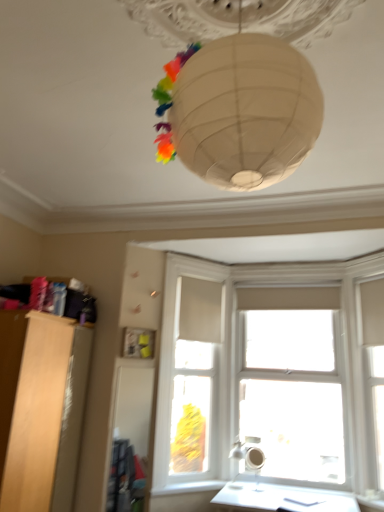
What do you see at coordinates (249, 455) in the screenshot? The image size is (384, 512). I see `matte white lampshade at lower center` at bounding box center [249, 455].

The image size is (384, 512). Identify the location of matte white lampshade at lower center. (249, 455).

Is the depth of light wood cabinet at left greater than that of white matte window frame at right, which is the 1th window frame in right-to-left order?

No, light wood cabinet at left is in front of white matte window frame at right, which is the 1th window frame in right-to-left order.

Is point (34, 378) positioned after point (379, 374)?

No, (34, 378) is closer to viewer.

How distant is light wood cabinet at left from white matte window frame at right, the 2th window frame from the left?

light wood cabinet at left and white matte window frame at right, the 2th window frame from the left, are 8.35 feet apart from each other.

Who is taller, white smooth window sill at lower center or white wood window frame at center, marked as the first window frame in a left-to-right arrangement?

→ With more height is white wood window frame at center, marked as the first window frame in a left-to-right arrangement.

Consider the image. Are white smooth window sill at lower center and white wood window frame at center, arranged as the second window frame when viewed from the right, making contact?

No, white smooth window sill at lower center is not beside white wood window frame at center, arranged as the second window frame when viewed from the right.

Between white smooth window sill at lower center and white wood window frame at center, marked as the first window frame in a left-to-right arrangement, which one has smaller width?

white smooth window sill at lower center.

Is white smooth window sill at lower center positioned with its back to white wood window frame at center, marked as the first window frame in a left-to-right arrangement?

No.

Consider the image. What's the angular difference between matte white lampshade at lower center and white wood window frame at center, arranged as the second window frame when viewed from the right,'s facing directions?

The angular difference between matte white lampshade at lower center and white wood window frame at center, arranged as the second window frame when viewed from the right, is 45.1 degrees.

Is matte white lampshade at lower center far away from white wood window frame at center, arranged as the second window frame when viewed from the right?

Actually, matte white lampshade at lower center and white wood window frame at center, arranged as the second window frame when viewed from the right, are a little close together.

Considering the relative sizes of matte white lampshade at lower center and white wood window frame at center, arranged as the second window frame when viewed from the right, in the image provided, is matte white lampshade at lower center smaller than white wood window frame at center, arranged as the second window frame when viewed from the right,?

Yes, matte white lampshade at lower center is smaller than white wood window frame at center, arranged as the second window frame when viewed from the right.

Can you confirm if white wood window frame at center, arranged as the second window frame when viewed from the right, is taller than transparent glass window at center?

In fact, white wood window frame at center, arranged as the second window frame when viewed from the right, may be shorter than transparent glass window at center.

Based on their positions, is white wood window frame at center, arranged as the second window frame when viewed from the right, located to the left or right of transparent glass window at center?

From the image, it's evident that white wood window frame at center, arranged as the second window frame when viewed from the right, is to the left of transparent glass window at center.

Can we say white wood window frame at center, arranged as the second window frame when viewed from the right, lies outside transparent glass window at center?

Yes.

Which object is closer to the camera, white wood window frame at center, arranged as the second window frame when viewed from the right, or transparent glass window at center?

white wood window frame at center, arranged as the second window frame when viewed from the right, is in front.

Which of these two, transparent glass window at center or white smooth window sill at lower center, is wider?

With larger width is transparent glass window at center.

From the image's perspective, is transparent glass window at center located above or below white smooth window sill at lower center?

Based on their image positions, transparent glass window at center is located above white smooth window sill at lower center.

From a real-world perspective, is transparent glass window at center on top of white smooth window sill at lower center?

Yes, from a real-world perspective, transparent glass window at center is on top of white smooth window sill at lower center.

Which is behind, point (293, 476) or point (153, 496)?

The point (293, 476) is more distant.

In terms of width, does transparent glass window at center look wider or thinner when compared to light wood cabinet at left?

transparent glass window at center is thinner than light wood cabinet at left.

Looking at the image, does transparent glass window at center seem bigger or smaller compared to light wood cabinet at left?

transparent glass window at center is smaller than light wood cabinet at left.

Which is in front, point (273, 432) or point (18, 494)?

The point (18, 494) is more forward.

Could light wood cabinet at left be considered to be inside transparent glass window at center?

No, light wood cabinet at left is located outside of transparent glass window at center.

Is white wood window frame at center, marked as the first window frame in a left-to-right arrangement, aimed at white smooth window sill at lower center?

No, white wood window frame at center, marked as the first window frame in a left-to-right arrangement, is not aimed at white smooth window sill at lower center.

From the image's perspective, between white wood window frame at center, arranged as the second window frame when viewed from the right, and white smooth window sill at lower center, which one is located above?

white wood window frame at center, arranged as the second window frame when viewed from the right, appears higher in the image.

Which is correct: white wood window frame at center, arranged as the second window frame when viewed from the right, is inside white smooth window sill at lower center, or outside of it?

white wood window frame at center, arranged as the second window frame when viewed from the right, cannot be found inside white smooth window sill at lower center.

You are a GUI agent. You are given a task and a screenshot of the screen. Output one action in this format:
    pyautogui.click(x=<x>, y=<y>)
    Task: Click on the 1st window frame above the white smooth window sill at lower center (from the image's perspective)
    The height and width of the screenshot is (512, 384).
    Given the screenshot: What is the action you would take?
    pyautogui.click(x=190, y=378)

From the light wood cabinet at left, count 2nd window frame to the right and point to it. Please provide its 2D coordinates.

[(372, 373)]

Where is `window sill located below the white wood window frame at center, marked as the first window frame in a left-to-right arrangement (from the image's perspective)`? The height and width of the screenshot is (512, 384). window sill located below the white wood window frame at center, marked as the first window frame in a left-to-right arrangement (from the image's perspective) is located at coordinates (189, 488).

When comparing their distances from white matte window frame at right, which is the 1th window frame in right-to-left order, does matte white lampshade at lower center or white smooth window sill at lower center seem closer?

matte white lampshade at lower center.

Consider the image. When comparing their distances from white wood window frame at center, marked as the first window frame in a left-to-right arrangement, does white smooth window sill at lower center or transparent glass window at center seem further?

Among the two, white smooth window sill at lower center is located further to white wood window frame at center, marked as the first window frame in a left-to-right arrangement.

From the picture: Considering their positions, is transparent glass window at center positioned closer to white wood window frame at center, arranged as the second window frame when viewed from the right, than white smooth window sill at lower center?

transparent glass window at center lies closer to white wood window frame at center, arranged as the second window frame when viewed from the right, than the other object.

Estimate the real-world distances between objects in this image. Which object is closer to transparent glass window at center, white matte window frame at right, which is the 1th window frame in right-to-left order, or white smooth window sill at lower center?

Based on the image, white matte window frame at right, which is the 1th window frame in right-to-left order, appears to be nearer to transparent glass window at center.

From the image, which object appears to be nearer to matte white lampshade at lower center, light wood cabinet at left or white matte window frame at right, which is the 1th window frame in right-to-left order?

white matte window frame at right, which is the 1th window frame in right-to-left order, lies closer to matte white lampshade at lower center than the other object.

From the image, which object appears to be nearer to transparent glass window at center, white smooth window sill at lower center or white matte window frame at right, which is the 1th window frame in right-to-left order?

Based on the image, white matte window frame at right, which is the 1th window frame in right-to-left order, appears to be nearer to transparent glass window at center.

Considering their positions, is light wood cabinet at left positioned further to matte white lampshade at lower center than white wood window frame at center, marked as the first window frame in a left-to-right arrangement?

light wood cabinet at left.

Estimate the real-world distances between objects in this image. Which object is closer to transparent glass window at center, white matte window frame at right, which is the 1th window frame in right-to-left order, or matte white lampshade at lower center?

white matte window frame at right, which is the 1th window frame in right-to-left order, is closer to transparent glass window at center.

Image resolution: width=384 pixels, height=512 pixels. I want to click on window between white smooth window sill at lower center and white matte window frame at right, the 2th window frame from the left, so click(294, 386).

This screenshot has width=384, height=512. What are the coordinates of `lamp that lies between transparent glass window at center and white smooth window sill at lower center from top to bottom` in the screenshot? It's located at (249, 455).

The height and width of the screenshot is (512, 384). I want to click on window between white wood window frame at center, arranged as the second window frame when viewed from the right, and matte white lampshade at lower center vertically, so click(294, 386).

Find the location of a particular element. The height and width of the screenshot is (512, 384). window situated between light wood cabinet at left and white matte window frame at right, the 2th window frame from the left, from left to right is located at coordinates (294, 386).